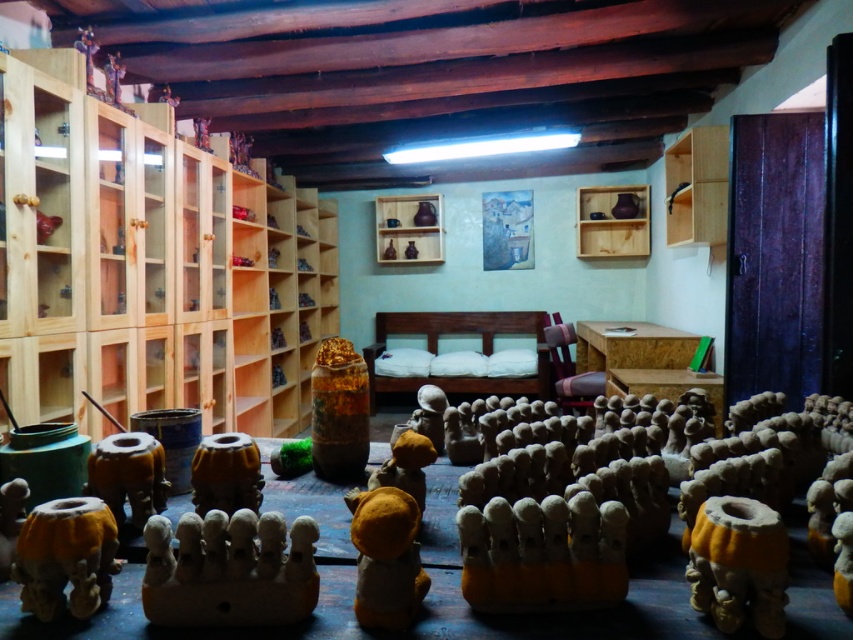
Question: Which object is positioned farthest from the translucent amber vase at center?

Choices:
 (A) wooden shelf at upper center
 (B) yellow felt toy at center
 (C) natural wood bookshelf at left
 (D) matte orange vase at lower right

Answer: (A)

Question: Which is nearer to the matte orange vase at lower right?

Choices:
 (A) yellow felt toy at center
 (B) translucent amber vase at center

Answer: (A)

Question: Is matte orange vase at lower right positioned behind wooden shelf at upper center?

Choices:
 (A) yes
 (B) no

Answer: (B)

Question: Which point appears closest to the camera in this image?

Choices:
 (A) (410, 582)
 (B) (216, 467)
 (C) (102, 508)

Answer: (A)

Question: Considering the relative positions of matte yellow clay toy at lower left and matte wood shelf at center in the image provided, where is matte yellow clay toy at lower left located with respect to matte wood shelf at center?

Choices:
 (A) above
 (B) below

Answer: (B)

Question: Does matte yellow clay toy at lower left have a lesser width compared to wooden shelf at upper center?

Choices:
 (A) yes
 (B) no

Answer: (A)